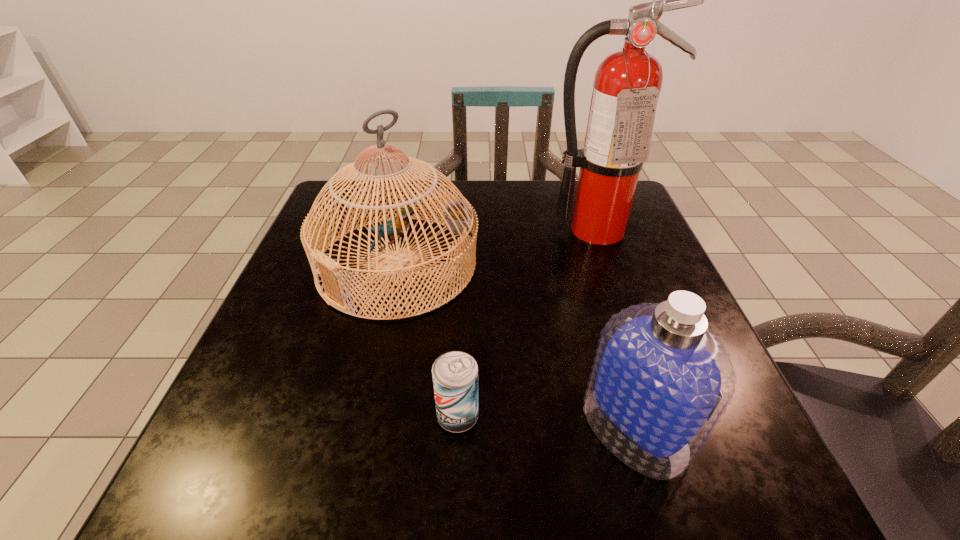
At what (x,y) coordinates should I click in order to perform the action: click on free location at the far right corner of the desktop. Please return your answer as a coordinate pair (x, y). The image size is (960, 540). Looking at the image, I should click on (644, 220).

Identify the location of free space at the near right corner of the desktop. (733, 491).

Locate an element on the screen. The width and height of the screenshot is (960, 540). free space between the birdcage and the tallest object is located at coordinates (496, 247).

Find the location of a particular element. Image resolution: width=960 pixels, height=540 pixels. blank region between the shortest object and the tallest object is located at coordinates (527, 322).

Identify the location of vacant region between the cleansing agent and the shortest object. This screenshot has width=960, height=540. (546, 422).

What are the coordinates of `free space between the second tallest object and the shortest object` in the screenshot? It's located at (427, 340).

Where is `free space between the birdcage and the tallest object`? free space between the birdcage and the tallest object is located at coordinates (496, 247).

Find the location of `free area in between the fire extinguisher and the second tallest object`. free area in between the fire extinguisher and the second tallest object is located at coordinates (496, 247).

Where is `vacant area that lies between the cleansing agent and the birdcage`? This screenshot has height=540, width=960. vacant area that lies between the cleansing agent and the birdcage is located at coordinates (516, 346).

Find the location of `unoccupied position between the third tallest object and the shortest object`. unoccupied position between the third tallest object and the shortest object is located at coordinates (546, 422).